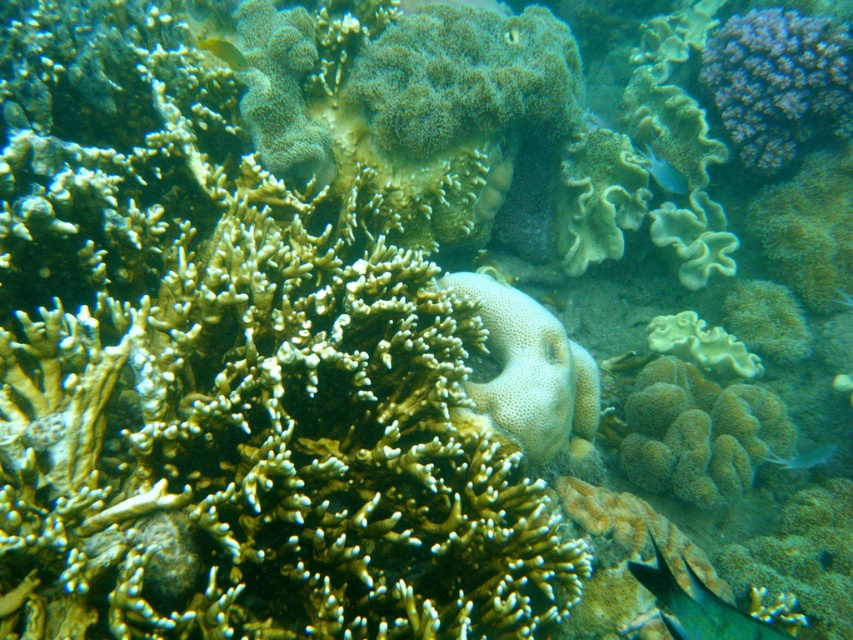
You are a marine biologist observing this underwater scene. You notice two fish species here, the blue glossy fish at upper center and the shiny blue fish at lower right. Which one do you think is larger in size?

The blue glossy fish at upper center is bigger than the shiny blue fish at lower right according to the observation.

You are a marine biologist observing the underwater scene. You notice two fish species in the image. The blue glossy fish at upper center and the shiny blue fish at lower right. Which fish has a smaller width?

The blue glossy fish at upper center has a smaller width than the shiny blue fish at lower right.